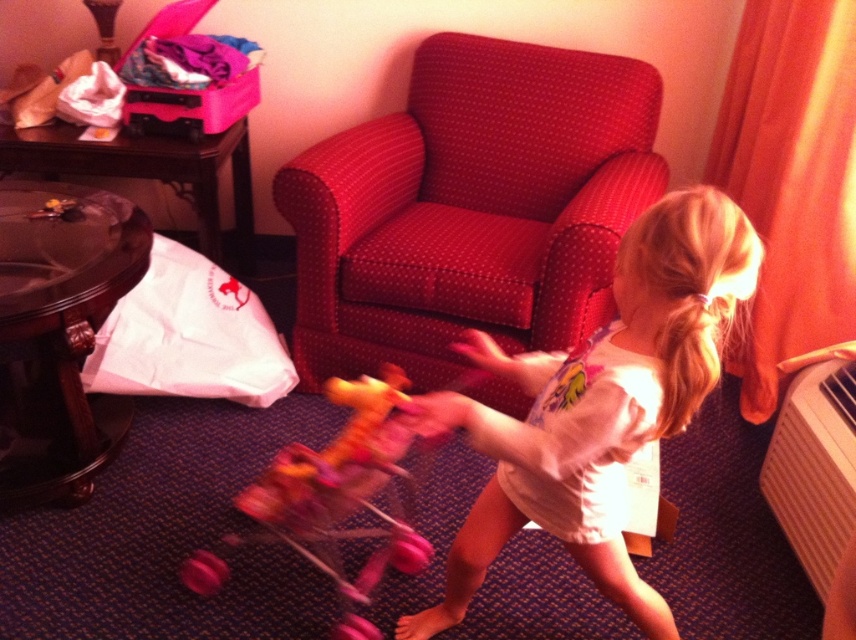
Question: Which object is the closest to the pink plastic baby carriage at center?

Choices:
 (A) white plastic radiator at lower right
 (B) white cotton shirt at center
 (C) polka dot fabric armchair at center

Answer: (B)

Question: Which of the following is the farthest from the observer?

Choices:
 (A) white cotton shirt at center
 (B) white plastic radiator at lower right

Answer: (B)

Question: Among these points, which one is nearest to the camera?

Choices:
 (A) (406, 428)
 (B) (299, 164)

Answer: (A)

Question: Is pink plastic baby carriage at center wider than white plastic radiator at lower right?

Choices:
 (A) no
 (B) yes

Answer: (B)

Question: In this image, where is white cotton shirt at center located relative to pink plastic baby carriage at center?

Choices:
 (A) above
 (B) below

Answer: (A)

Question: In this image, where is white cotton shirt at center located relative to white plastic radiator at lower right?

Choices:
 (A) below
 (B) above

Answer: (B)